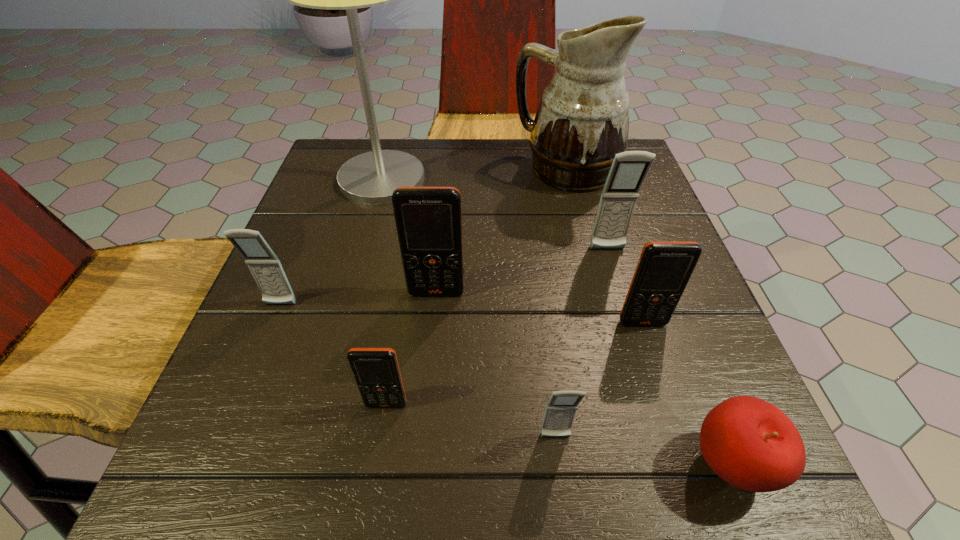
Find the location of a particular element. cellular telephone situated at the near edge is located at coordinates (560, 411).

Locate an element on the screen. apple that is at the near edge is located at coordinates (751, 444).

Identify the location of table lamp at the left edge. (371, 178).

You are a GUI agent. You are given a task and a screenshot of the screen. Output one action in this format:
    pyautogui.click(x=<x>, y=<y>)
    Task: Click on the cellular telephone present at the left edge
    The width and height of the screenshot is (960, 540).
    Given the screenshot: What is the action you would take?
    pyautogui.click(x=264, y=265)

Locate an element on the screen. pitcher positioned at the right edge is located at coordinates (582, 122).

In order to click on apple that is at the right edge in this screenshot , I will do `click(751, 444)`.

Locate an element on the screen. object present at the far left corner is located at coordinates (371, 178).

In order to click on object that is at the far right corner in this screenshot , I will do `click(582, 122)`.

The image size is (960, 540). In order to click on object present at the near right corner in this screenshot , I will do `click(751, 444)`.

Locate an element on the screen. Image resolution: width=960 pixels, height=540 pixels. vacant space at the far edge is located at coordinates (541, 184).